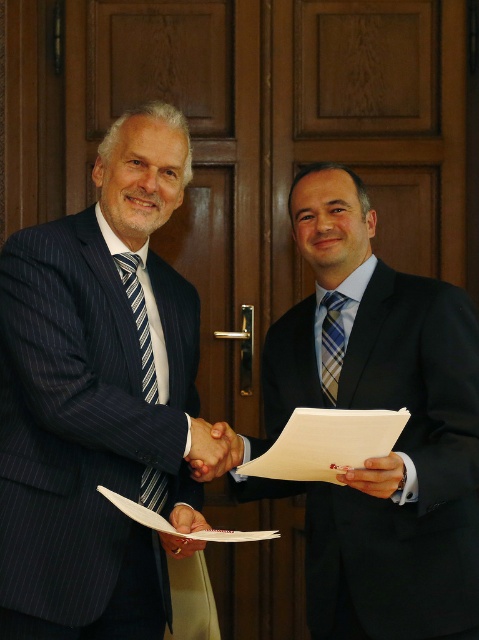
Question: Which point is closer to the camera taking this photo?

Choices:
 (A) (71, 520)
 (B) (348, 300)

Answer: (A)

Question: Is striped silk tie at center further to camera compared to smooth skin hand at center?

Choices:
 (A) no
 (B) yes

Answer: (B)

Question: Based on their relative distances, which object is nearer to the smooth skin hand at center?

Choices:
 (A) blue pinstripe suit at center
 (B) matte black suit at center
 (C) striped silk tie at center

Answer: (B)

Question: Observing the image, what is the correct spatial positioning of blue pinstripe suit at center in reference to smooth skin hand at center?

Choices:
 (A) below
 (B) above

Answer: (B)

Question: Which object is the farthest from the striped silk tie at center?

Choices:
 (A) matte black suit at center
 (B) matte black hand at center
 (C) striped fabric tie at left
 (D) blue pinstripe suit at center

Answer: (B)

Question: Considering the relative positions of smooth skin handshake at center and striped silk tie at center in the image provided, where is smooth skin handshake at center located with respect to striped silk tie at center?

Choices:
 (A) above
 (B) below

Answer: (B)